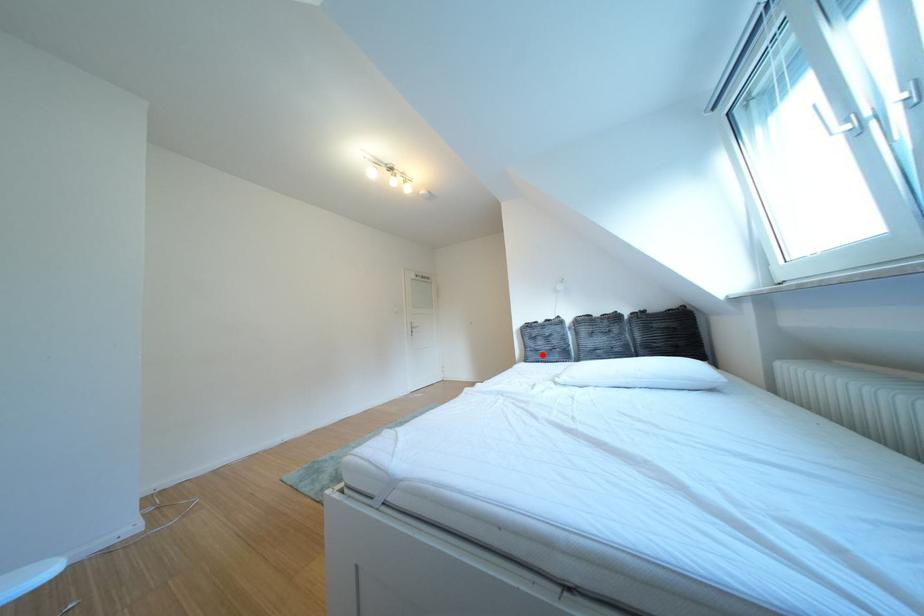
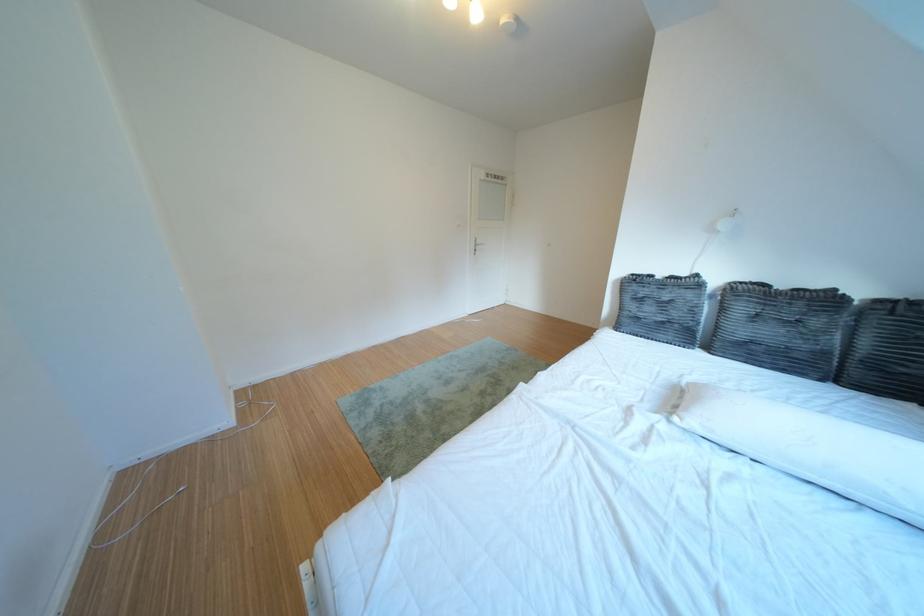
The point at the highlighted location is marked in the first image. Where is the corresponding point in the second image?

(639, 318)